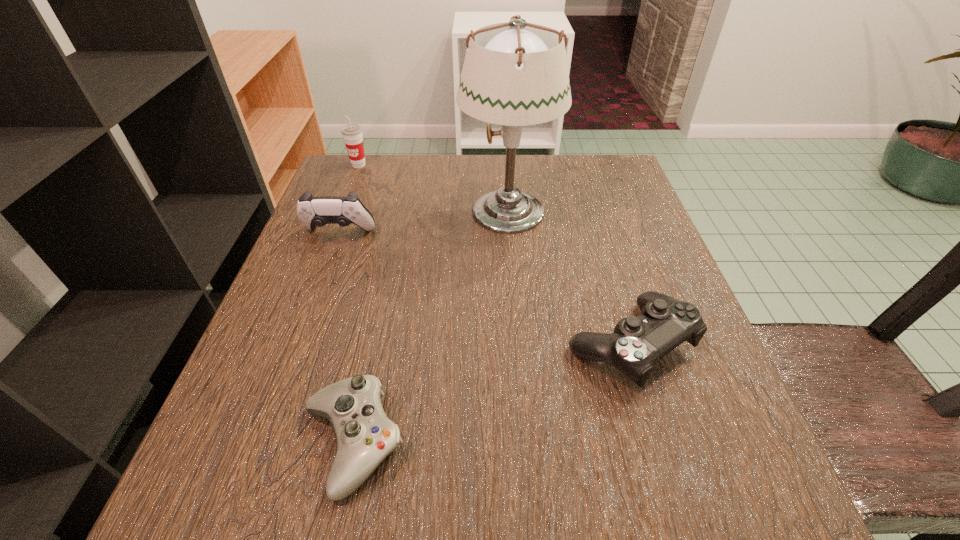
Image resolution: width=960 pixels, height=540 pixels. I want to click on vacant area located on the front-facing side of the farthest control, so click(313, 305).

Image resolution: width=960 pixels, height=540 pixels. In order to click on vacant space located 0.070m on the back of the rightmost control in this screenshot , I will do `click(608, 274)`.

Find the location of a particular element. vacant space situated on the back of the shortest object is located at coordinates (393, 254).

Identify the location of lampshade present at the far edge. (515, 74).

In order to click on cup located at the far edge in this screenshot , I will do `click(352, 134)`.

The width and height of the screenshot is (960, 540). Find the location of `object present at the near edge`. object present at the near edge is located at coordinates (364, 435).

Where is `cup that is at the left edge`? Image resolution: width=960 pixels, height=540 pixels. cup that is at the left edge is located at coordinates (352, 134).

Find the location of a particular element. Image resolution: width=960 pixels, height=540 pixels. object located at the right edge is located at coordinates tap(637, 343).

Find the location of a particular element. The image size is (960, 540). object that is at the far left corner is located at coordinates (352, 134).

This screenshot has height=540, width=960. Find the location of `object at the near left corner`. object at the near left corner is located at coordinates (364, 435).